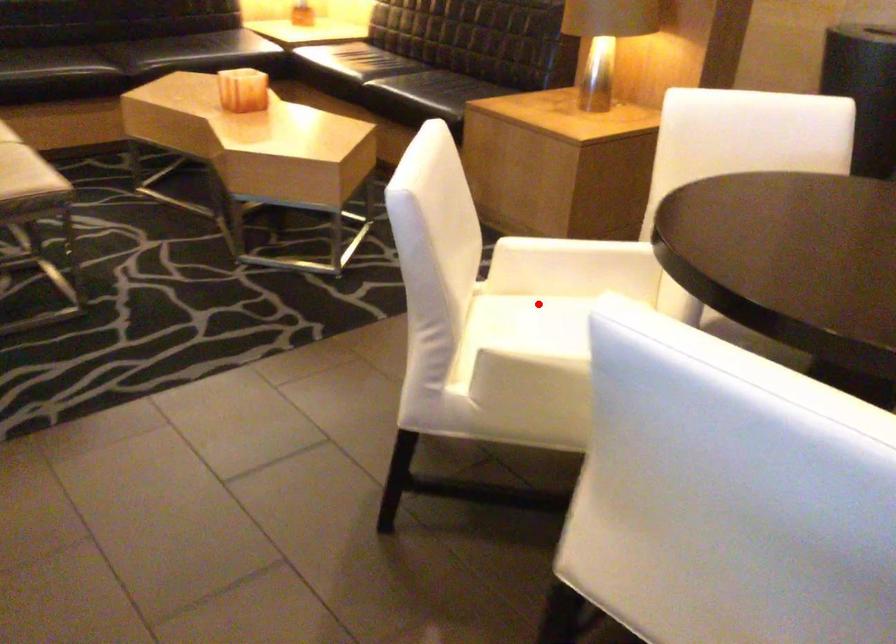
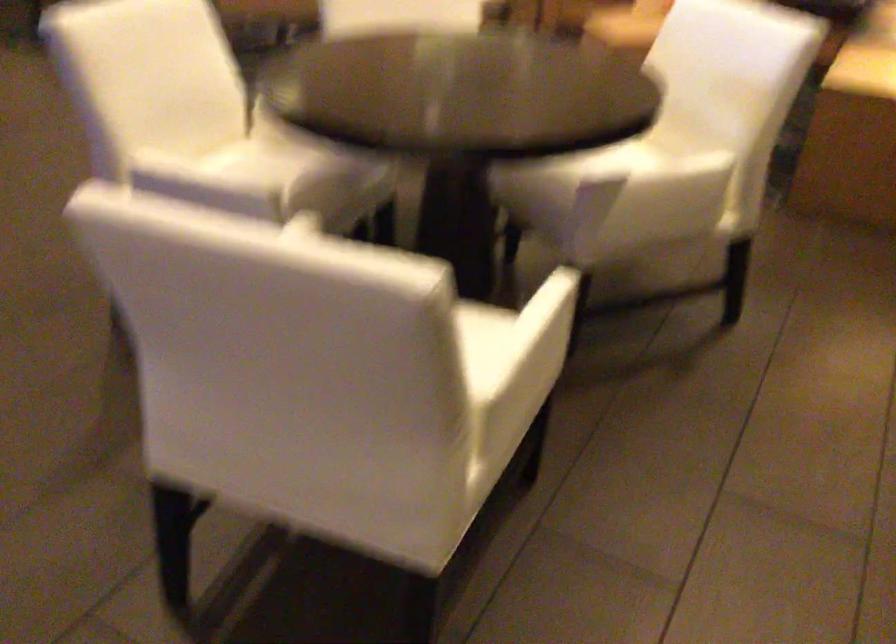
Question: I am providing you with two images of the same scene from different viewpoints. A red point is marked on the first image. At the location where the point appears in image 1, is it still visible in image 2?

Choices:
 (A) Yes
 (B) No

Answer: (B)